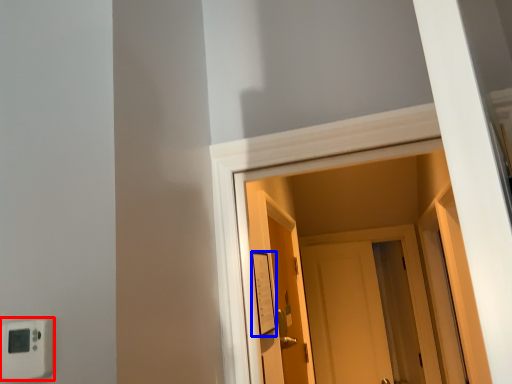
Question: Which object appears farthest to the camera in this image, light switch (highlighted by a red box) or light switch (highlighted by a blue box)?

Choices:
 (A) light switch
 (B) light switch

Answer: (B)